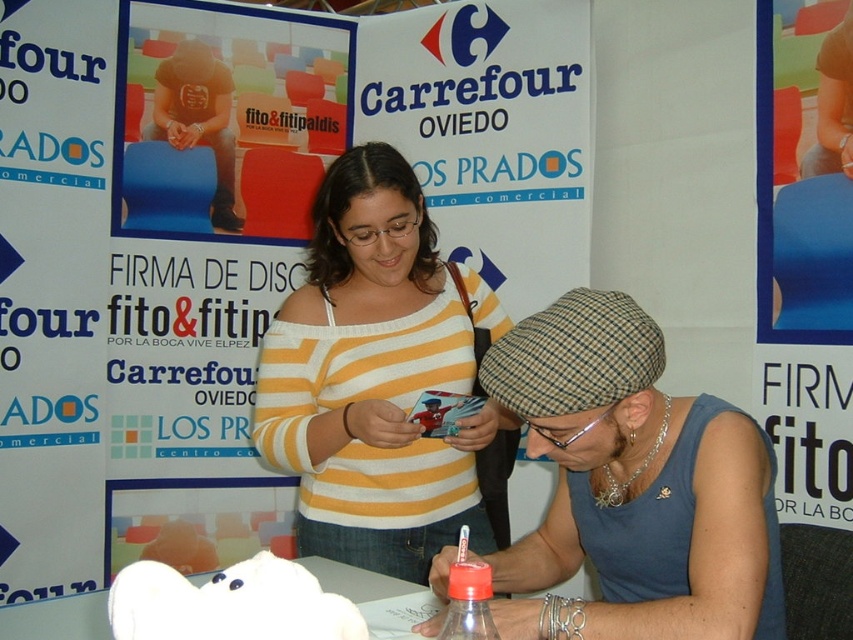
Is striped cotton shirt at center below yellow/white striped sweater at center?

Indeed, striped cotton shirt at center is positioned under yellow/white striped sweater at center.

Describe the element at coordinates (633, 484) in the screenshot. I see `striped cotton shirt at center` at that location.

Locate an element on the screen. The image size is (853, 640). striped cotton shirt at center is located at coordinates (633, 484).

Based on the photo, can you confirm if striped cotton shirt at center is bigger than translucent plastic bottle at lower center?

Indeed, striped cotton shirt at center has a larger size compared to translucent plastic bottle at lower center.

Does striped cotton shirt at center appear on the left side of translucent plastic bottle at lower center?

In fact, striped cotton shirt at center is to the right of translucent plastic bottle at lower center.

Image resolution: width=853 pixels, height=640 pixels. What do you see at coordinates (633, 484) in the screenshot?
I see `striped cotton shirt at center` at bounding box center [633, 484].

Where is `striped cotton shirt at center`? This screenshot has height=640, width=853. striped cotton shirt at center is located at coordinates (633, 484).

What do you see at coordinates (229, 604) in the screenshot? The height and width of the screenshot is (640, 853). I see `white matte piggy bank at lower center` at bounding box center [229, 604].

Consider the image. Is white matte piggy bank at lower center further to camera compared to translucent plastic bottle at lower center?

No, white matte piggy bank at lower center is closer to the viewer.

Where is `white matte piggy bank at lower center`? The width and height of the screenshot is (853, 640). white matte piggy bank at lower center is located at coordinates (229, 604).

The image size is (853, 640). Identify the location of white matte piggy bank at lower center. (229, 604).